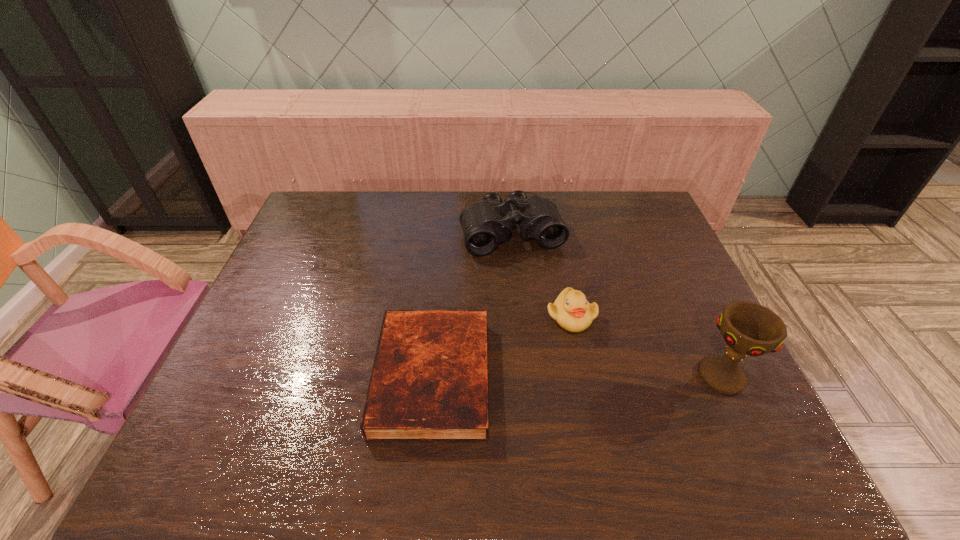
Locate an element on the screen. Image resolution: width=960 pixels, height=540 pixels. vacant space located 0.380m at the eyepieces of the binoculars is located at coordinates (560, 359).

Where is `free space located at the eyepieces of the binoculars`? The image size is (960, 540). free space located at the eyepieces of the binoculars is located at coordinates (559, 355).

This screenshot has height=540, width=960. What are the coordinates of `vacant region located at the eyepieces of the binoculars` in the screenshot? It's located at (561, 362).

Where is `vacant region located 0.160m at the face of the second shortest object`? The image size is (960, 540). vacant region located 0.160m at the face of the second shortest object is located at coordinates (618, 384).

Locate an element on the screen. The width and height of the screenshot is (960, 540). vacant area located 0.080m at the face of the second shortest object is located at coordinates (600, 357).

Identify the location of free location located 0.090m at the face of the second shortest object. The image size is (960, 540). (602, 360).

The width and height of the screenshot is (960, 540). What are the coordinates of `object that is positioned at the far edge` in the screenshot? It's located at (485, 224).

The width and height of the screenshot is (960, 540). I want to click on Bible situated at the near edge, so click(429, 382).

Locate an element on the screen. Image resolution: width=960 pixels, height=540 pixels. chalice situated at the near edge is located at coordinates (748, 328).

Where is `object present at the right edge`? The image size is (960, 540). object present at the right edge is located at coordinates (748, 328).